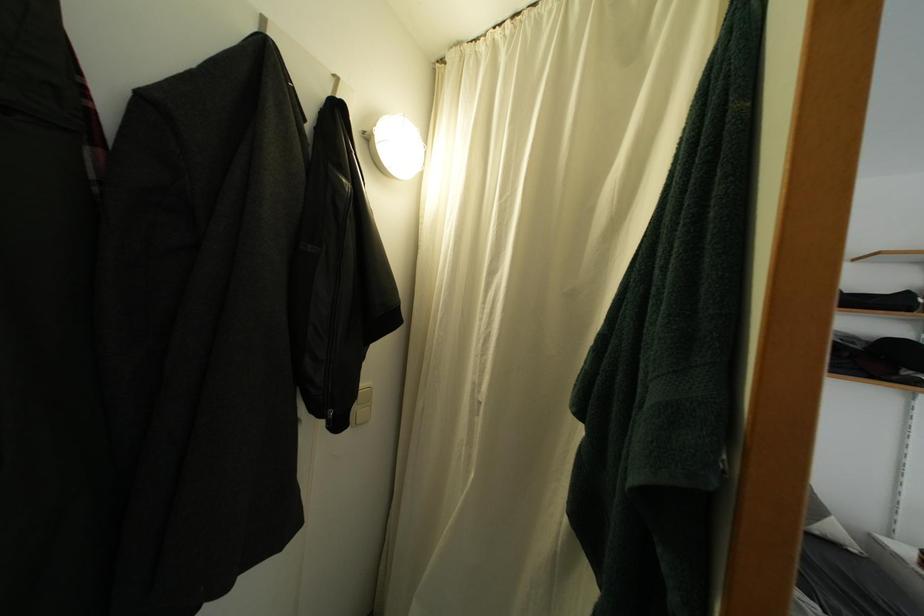
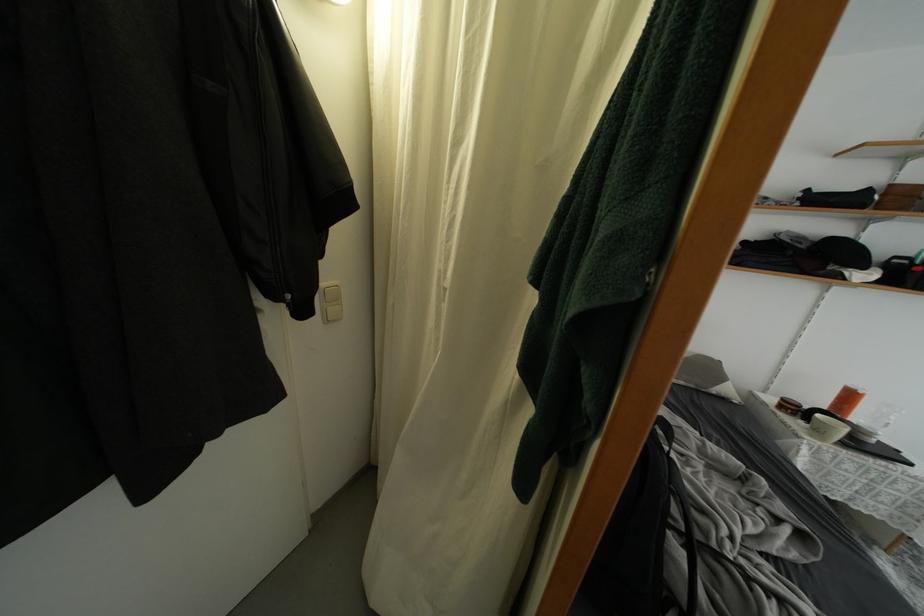
Question: The images are taken continuously from a first-person perspective. In which direction is your viewpoint rotating?

Choices:
 (A) Left
 (B) Right
 (C) Up
 (D) Down

Answer: (D)